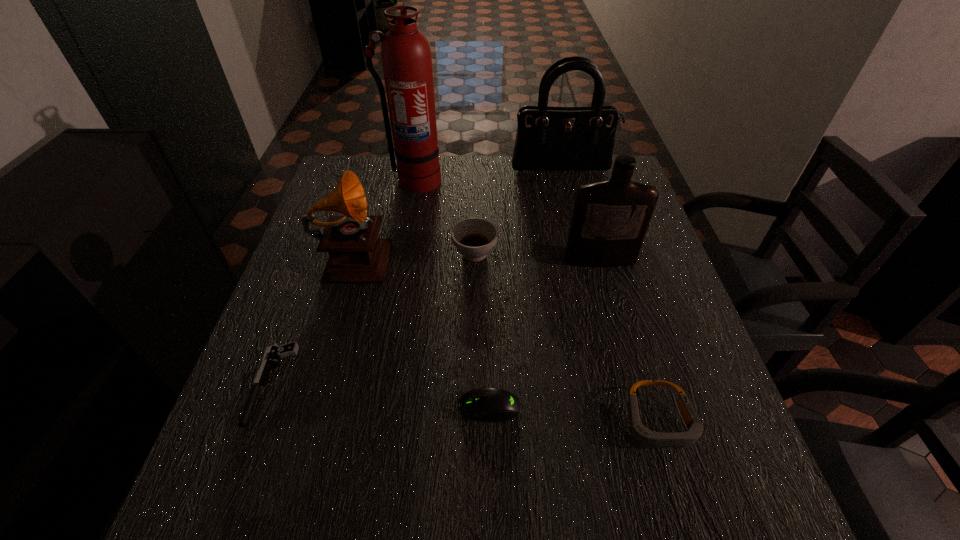
I want to click on the tallest object, so click(x=406, y=58).

At what (x,y) coordinates should I click in order to perform the action: click on handbag. Please return your answer as a coordinate pair (x, y). The image size is (960, 540). Looking at the image, I should click on (548, 138).

The height and width of the screenshot is (540, 960). Identify the location of liquor. (610, 219).

Locate an element on the screen. Image resolution: width=960 pixels, height=540 pixels. phonograph record is located at coordinates (356, 255).

Find the location of `soup bowl`. soup bowl is located at coordinates (474, 238).

Where is `goggles`? This screenshot has width=960, height=540. goggles is located at coordinates (643, 436).

The image size is (960, 540). I want to click on the seventh tallest object, so click(x=495, y=405).

Locate an element on the screen. The width and height of the screenshot is (960, 540). pistol is located at coordinates (273, 352).

Identify the location of free space located on the label side of the tallest object. (395, 288).

Image resolution: width=960 pixels, height=540 pixels. In order to click on blank space located 0.080m with an open clasp on the front of the handbag in this screenshot , I will do `click(567, 188)`.